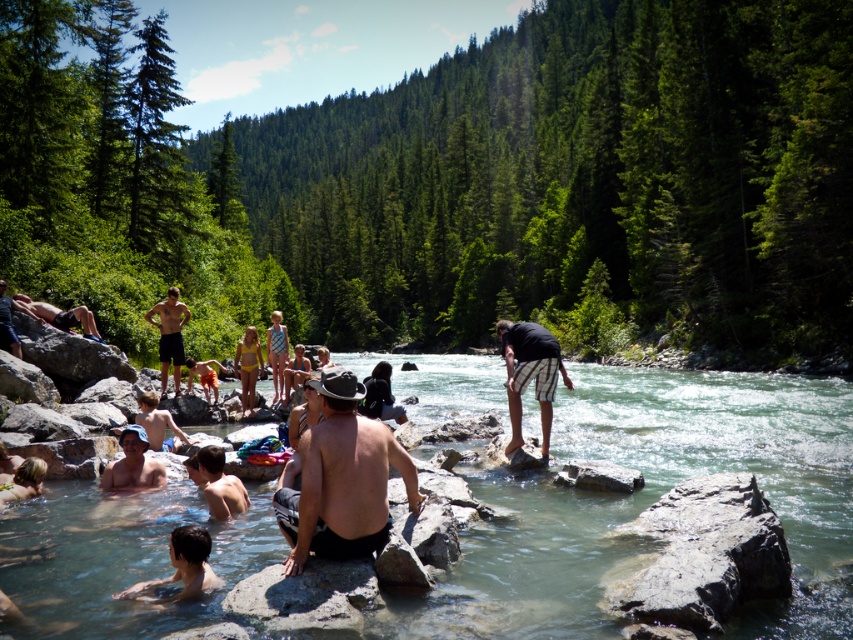
You are a photographer positioned at the riverbank. You want to take a photo that includes both the black striped shorts at center and the smooth skin boy at lower center. However, you need to ensure that the boy is not completely hidden behind the shorts. Is this possible based on their positions?

The smooth skin boy at lower center is behind the black striped shorts at center, so positioning yourself so the boy is not completely hidden may require angling the camera to capture both. Since the boy is behind, part of him might still be visible depending on the angle and distance between them.